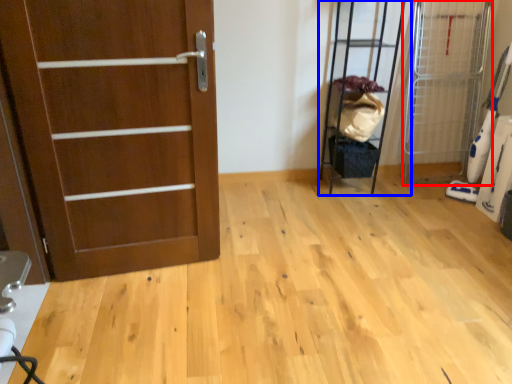
Question: Which point is closer to the camera, elevator (highlighted by a red box) or elevator (highlighted by a blue box)?

Choices:
 (A) elevator
 (B) elevator

Answer: (A)